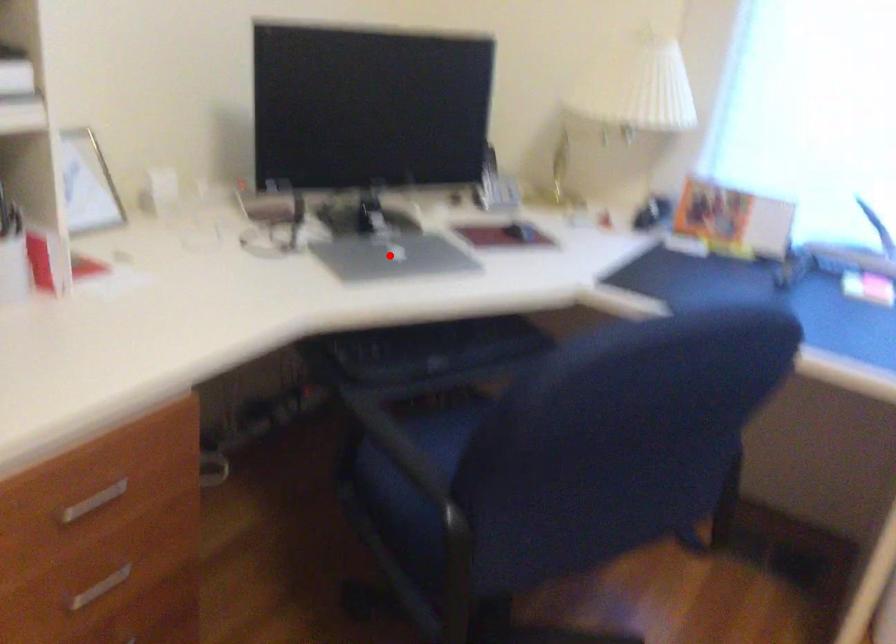
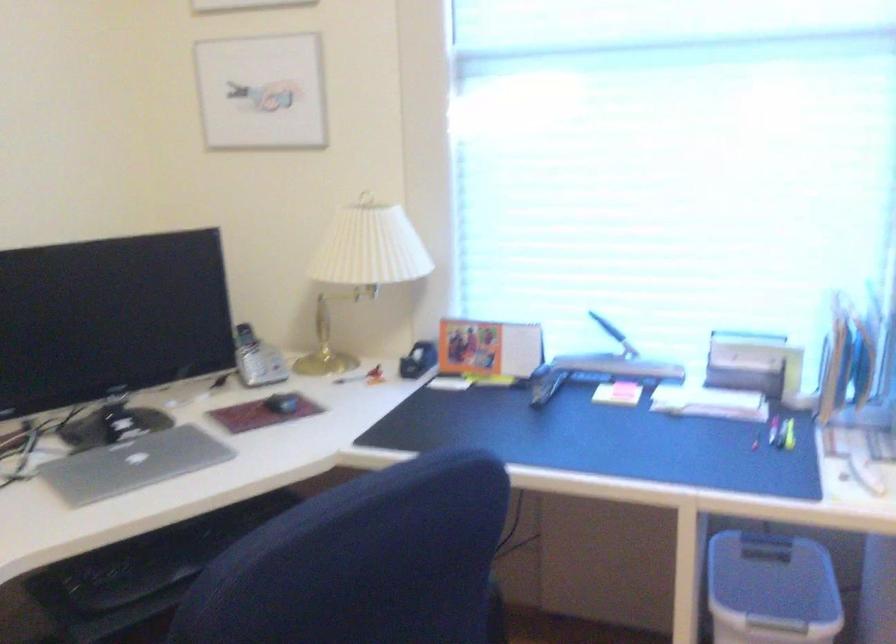
Where in the second image is the point corresponding to the highlighted location from the first image?

(133, 464)